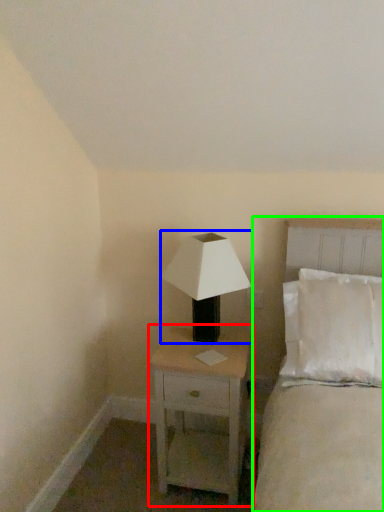
Question: Which object is positioned closest to nightstand (highlighted by a red box)? Select from lamp (highlighted by a blue box) and bed (highlighted by a green box).

Choices:
 (A) lamp
 (B) bed

Answer: (A)